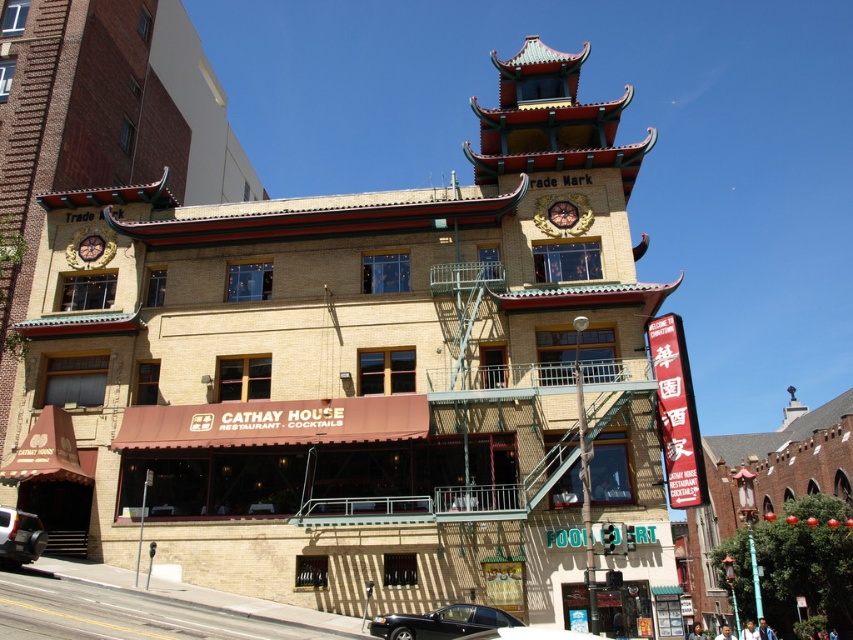
Question: Which is nearer to the gold metallic clock at upper left?

Choices:
 (A) shiny black sedan at lower center
 (B) silver metallic car at lower left
 (C) gold metallic clock at upper center
 (D) black glossy car at lower center

Answer: (B)

Question: Which of the following is the farthest from the observer?

Choices:
 (A) (96, 241)
 (B) (33, 547)
 (C) (560, 630)

Answer: (A)

Question: Which point is farther from the camera taking this photo?

Choices:
 (A) (380, 618)
 (B) (30, 547)

Answer: (B)

Question: Is black glossy car at lower center to the right of gold metallic clock at upper center from the viewer's perspective?

Choices:
 (A) yes
 (B) no

Answer: (B)

Question: Is black glossy car at lower center below gold metallic clock at upper left?

Choices:
 (A) no
 (B) yes

Answer: (B)

Question: Can you confirm if gold metallic clock at upper center is positioned to the right of gold metallic clock at upper left?

Choices:
 (A) yes
 (B) no

Answer: (A)